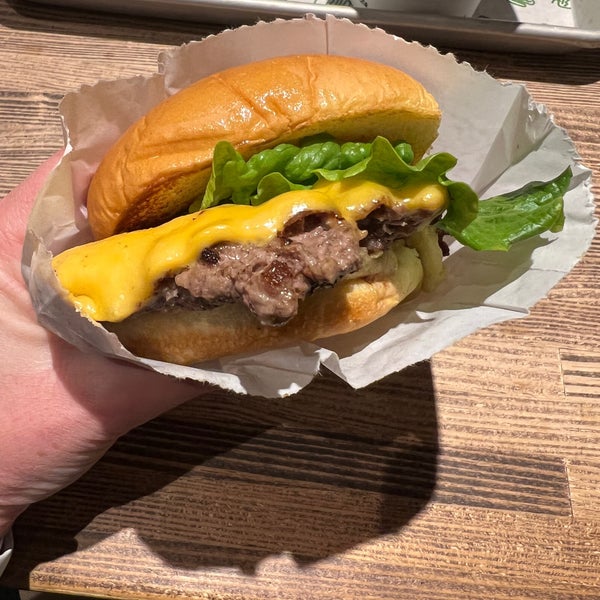
What are the coordinates of `tabletop` in the screenshot? It's located at (376, 457).